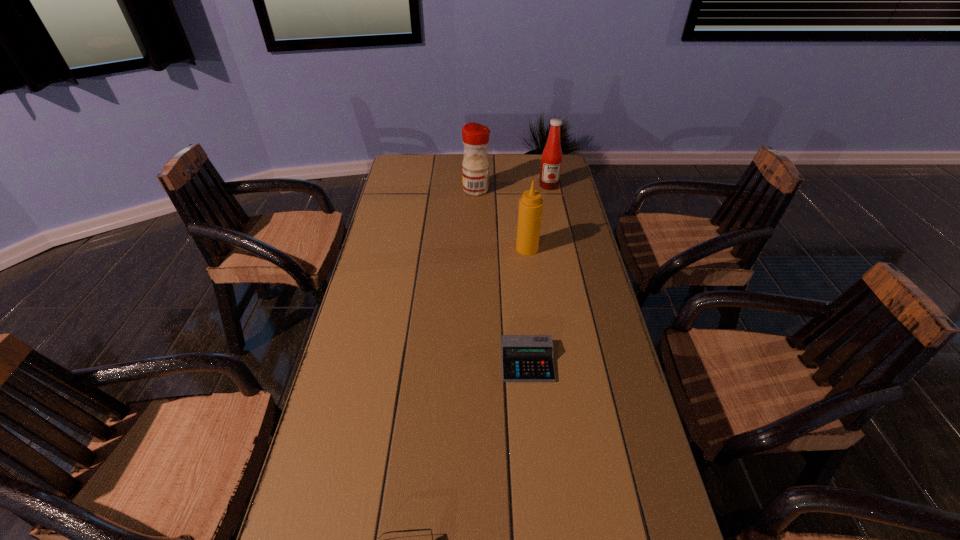
What are the coordinates of `vacant area between the rightmost condiment and the leftmost condiment` in the screenshot? It's located at (513, 188).

Find the location of a particular element. object that stands as the fourth closest to the leftmost object is located at coordinates (549, 178).

Identify which object is the second nearest to the calculator. Please provide its 2D coordinates. Your answer should be formatted as a tuple, i.e. [(x, y)], where the tuple contains the x and y coordinates of a point satisfying the conditions above.

[(413, 529)]

In order to click on condiment that stands as the second closest to the rightmost condiment in this screenshot , I will do `click(530, 211)`.

Identify which condiment is the nearest to the rightmost object. Please provide its 2D coordinates. Your answer should be formatted as a tuple, i.e. [(x, y)], where the tuple contains the x and y coordinates of a point satisfying the conditions above.

[(475, 174)]

This screenshot has height=540, width=960. I want to click on vacant space that satisfies the following two spatial constraints: 1. on the front side of the fourth object from right to left; 2. on the right side of the fourth farthest object, so click(x=474, y=362).

Find the location of `free location that satisfies the following two spatial constraints: 1. on the back side of the second nearest object; 2. on the left side of the second condiment from left to right`. free location that satisfies the following two spatial constraints: 1. on the back side of the second nearest object; 2. on the left side of the second condiment from left to right is located at coordinates (516, 248).